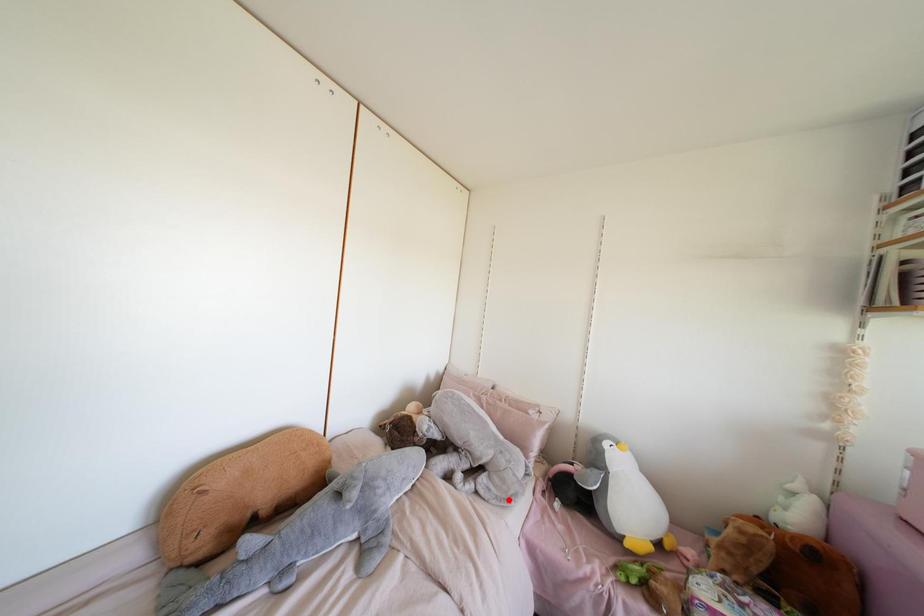
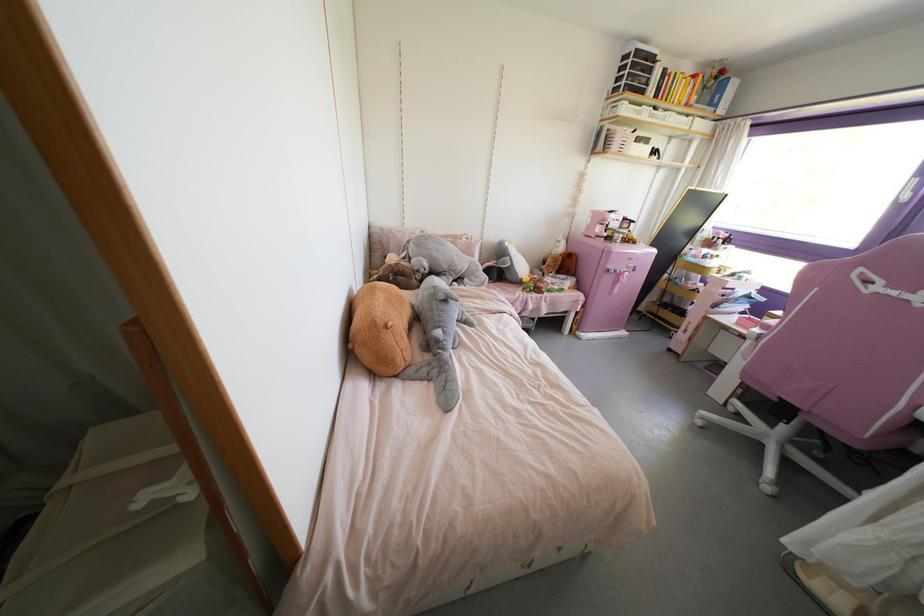
Question: A red point is marked in image1. In image2, is the corresponding 3D point closer to the camera or farther? Reply with the corresponding letter.

Choices:
 (A) The corresponding 3D point is closer.
 (B) The corresponding 3D point is farther.

Answer: (A)